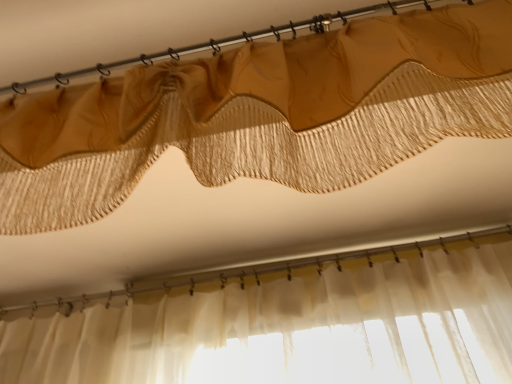
Question: Is matte gold curtain at upper center to the left of matte gold curtain at upper center from the viewer's perspective?

Choices:
 (A) yes
 (B) no

Answer: (A)

Question: Is the depth of matte gold curtain at upper center less than that of matte gold curtain at upper center?

Choices:
 (A) no
 (B) yes

Answer: (A)

Question: From a real-world perspective, is matte gold curtain at upper center located higher than matte gold curtain at upper center?

Choices:
 (A) yes
 (B) no

Answer: (A)

Question: Is matte gold curtain at upper center placed right next to matte gold curtain at upper center?

Choices:
 (A) no
 (B) yes

Answer: (A)

Question: Considering the relative sizes of matte gold curtain at upper center and matte gold curtain at upper center in the image provided, is matte gold curtain at upper center shorter than matte gold curtain at upper center?

Choices:
 (A) no
 (B) yes

Answer: (B)

Question: Does matte gold curtain at upper center have a lesser width compared to matte gold curtain at upper center?

Choices:
 (A) no
 (B) yes

Answer: (A)

Question: Does matte gold curtain at upper center come in front of matte gold curtain at upper center?

Choices:
 (A) yes
 (B) no

Answer: (A)

Question: From a real-world perspective, does matte gold curtain at upper center stand above matte gold curtain at upper center?

Choices:
 (A) yes
 (B) no

Answer: (B)

Question: Does matte gold curtain at upper center have a larger size compared to matte gold curtain at upper center?

Choices:
 (A) no
 (B) yes

Answer: (B)

Question: Can we say matte gold curtain at upper center lies outside matte gold curtain at upper center?

Choices:
 (A) no
 (B) yes

Answer: (B)

Question: Can you confirm if matte gold curtain at upper center is wider than matte gold curtain at upper center?

Choices:
 (A) yes
 (B) no

Answer: (B)

Question: From the image's perspective, would you say matte gold curtain at upper center is shown under matte gold curtain at upper center?

Choices:
 (A) yes
 (B) no

Answer: (A)

Question: From a real-world perspective, relative to matte gold curtain at upper center, is matte gold curtain at upper center vertically above or below?

Choices:
 (A) above
 (B) below

Answer: (A)